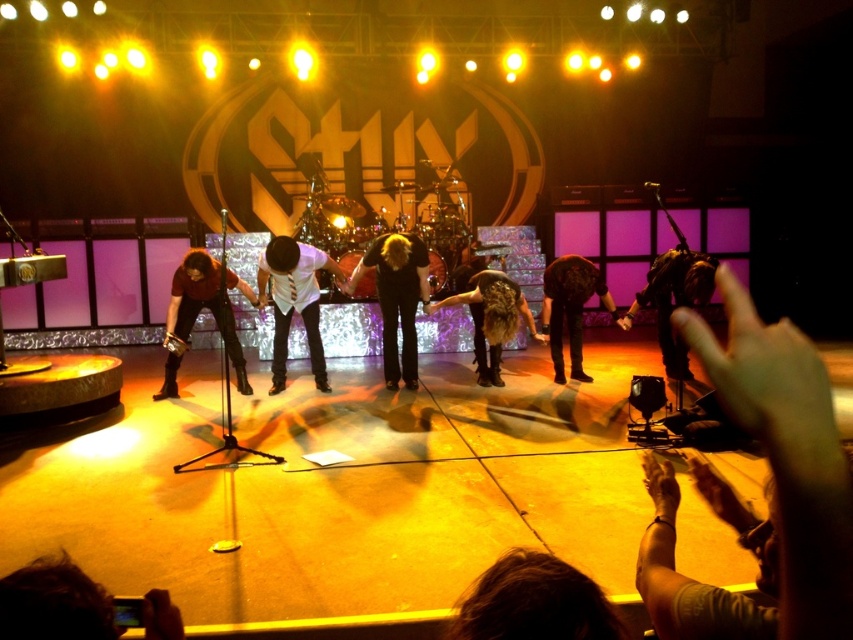
You are a stagehand preparing to move a large equipment box that requires a space larger than the matte brown leather jacket at lower left. Based on the scene, is there enough space next to the black leather pants at center for this equipment box?

The black leather pants at center is smaller than the matte brown leather jacket at lower left, so the space next to the black leather pants at center may not be sufficient for the equipment box which requires a space larger than the matte brown leather jacket at lower left.

Consider the image. You are a stagehand who needs to adjust the lighting for the band Styx. You notice two items at the center of the stage, the black leather pants at center and the leather jacket at center. Which item should you adjust the spotlight to focus on if you want to highlight the taller object?

The black leather pants at center is taller than the leather jacket at center, so you should adjust the spotlight to focus on the black leather pants at center to highlight the taller object.